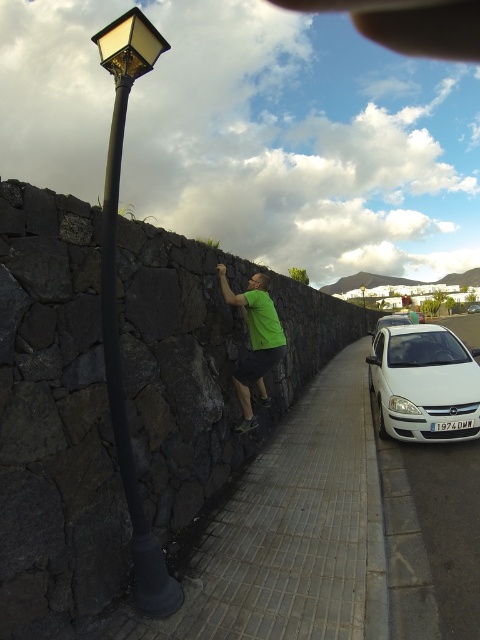
Measure the distance between matte black street light at left and white glossy sedan at right.

matte black street light at left is 46.68 meters away from white glossy sedan at right.

Is matte black street light at left smaller than white glossy sedan at right?

No.

Which is in front, point (113, 74) or point (472, 312)?

Positioned in front is point (113, 74).

The image size is (480, 640). I want to click on matte black street light at left, so click(x=115, y=301).

Is gray tile pavement at center to the left of white glossy car at right from the viewer's perspective?

Correct, you'll find gray tile pavement at center to the left of white glossy car at right.

Can you confirm if gray tile pavement at center is shorter than white glossy car at right?

Correct, gray tile pavement at center is not as tall as white glossy car at right.

Between point (272, 564) and point (408, 321), which one is positioned in front?

Point (272, 564)

I want to click on gray tile pavement at center, so click(291, 532).

Looking at this image, between gray tile pavement at center and white glossy sedan at right, which one is positioned higher?

white glossy sedan at right

Is gray tile pavement at center below white glossy sedan at right?

Yes, gray tile pavement at center is below white glossy sedan at right.

Who is more distant from viewer, (x=217, y=570) or (x=468, y=308)?

The point (x=468, y=308) is behind.

Find the location of a particular element. The height and width of the screenshot is (640, 480). gray tile pavement at center is located at coordinates (291, 532).